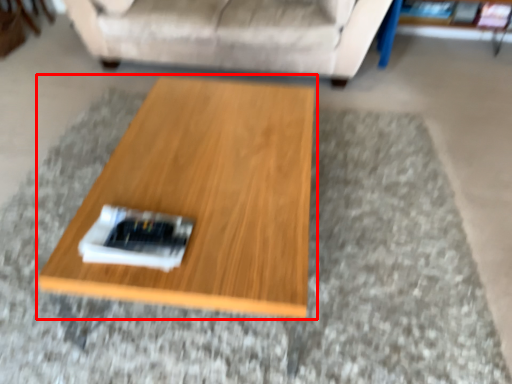
Question: Considering the relative positions of coffee table (annotated by the red box) and studio couch in the image provided, where is coffee table (annotated by the red box) located with respect to the staircase?

Choices:
 (A) right
 (B) left

Answer: (A)